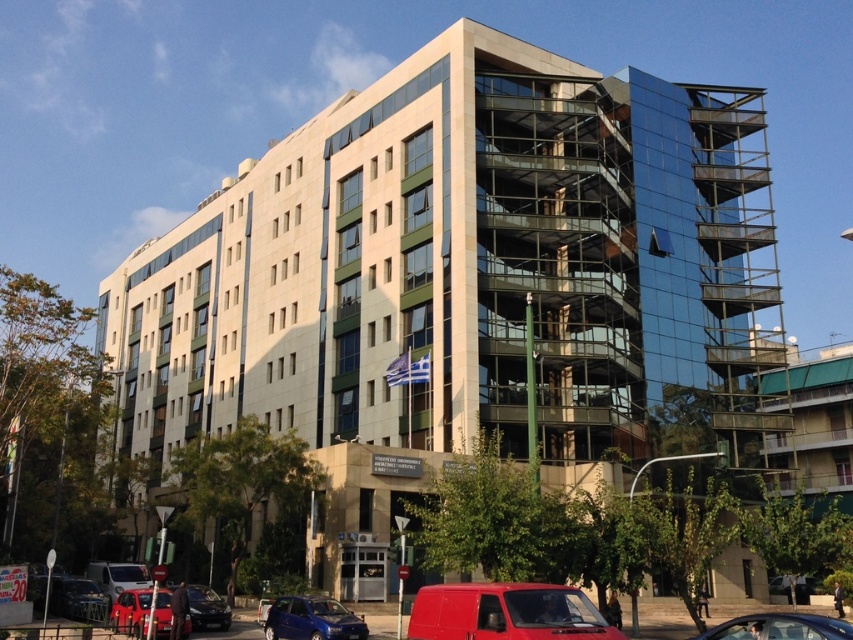
Question: Does matte red van at lower center appear on the left side of metallic blue suv at lower center?

Choices:
 (A) no
 (B) yes

Answer: (A)

Question: Is metallic red car at lower center above metallic silver van at lower left?

Choices:
 (A) no
 (B) yes

Answer: (B)

Question: Which point appears farthest from the camera in this image?

Choices:
 (A) (849, 632)
 (B) (300, 627)
 (C) (548, 582)

Answer: (B)

Question: Estimate the real-world distances between objects in this image. Which object is closer to the metallic blue suv at lower center?

Choices:
 (A) metallic silver van at lower left
 (B) metallic red car at lower center
 (C) metallic silver car at lower center
 (D) matte red van at lower center

Answer: (B)

Question: Can you confirm if metallic blue suv at lower center is positioned to the right of metallic silver van at lower left?

Choices:
 (A) yes
 (B) no

Answer: (A)

Question: Among these objects, which one is farthest from the camera?

Choices:
 (A) matte red van at lower center
 (B) shiny black sedan at lower left
 (C) metallic silver van at lower left

Answer: (C)